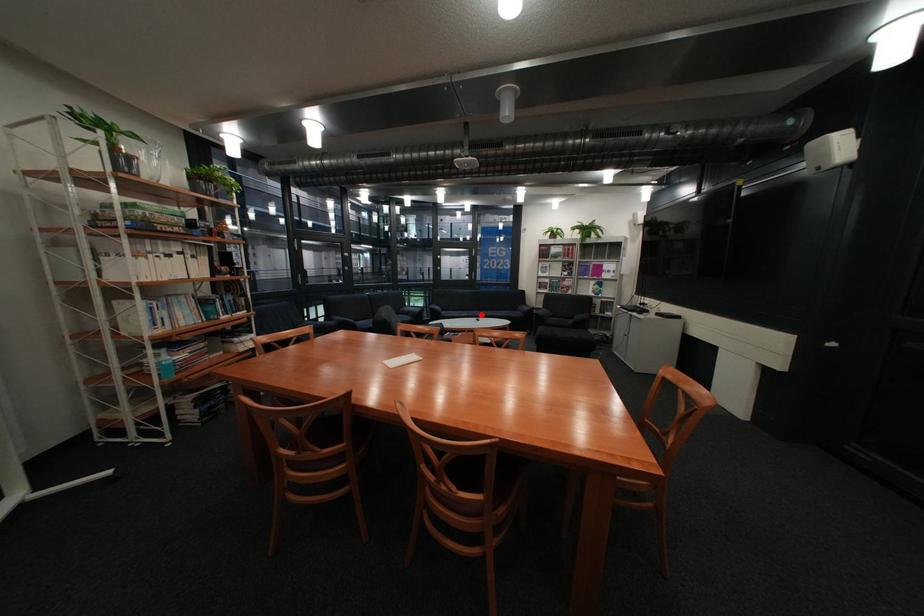
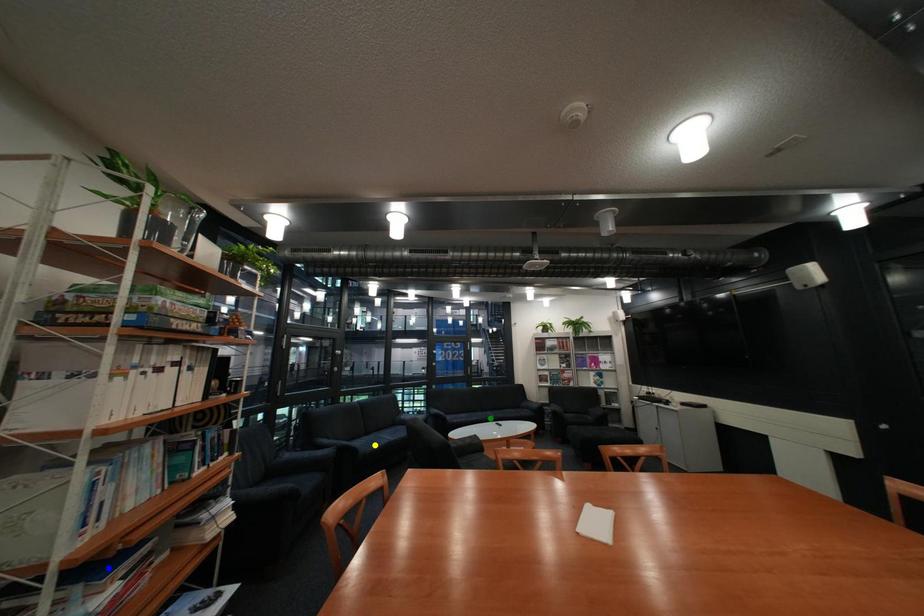
Question: I am providing you with two images of the same scene from different viewpoints. A red point is marked on the first image. You are given multiple points on the second image. Which point in image 2 is actually the same real-world point as the red point in image 1?

Choices:
 (A) blue point
 (B) green point
 (C) yellow point

Answer: (B)